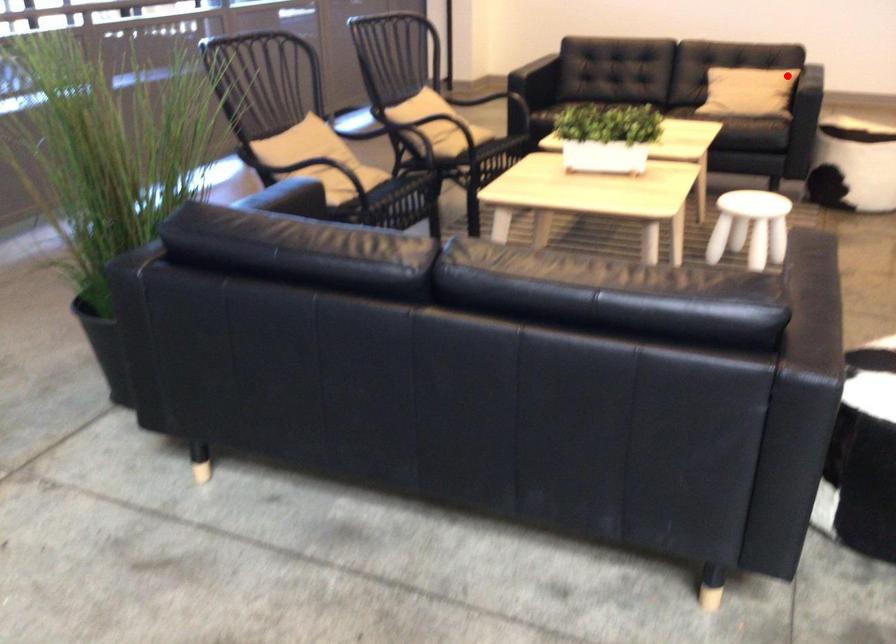
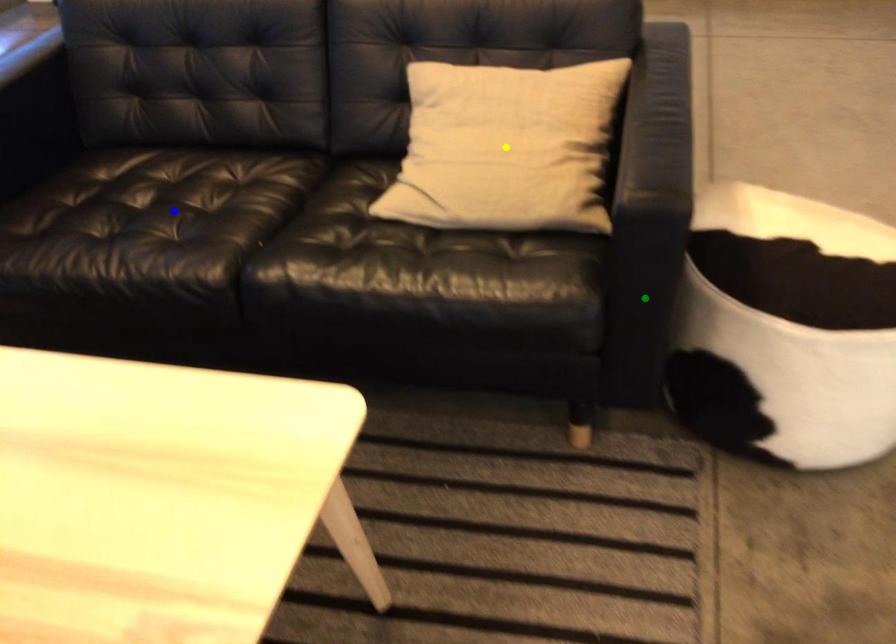
Question: I am providing you with two images of the same scene from different viewpoints. A red point is marked on the first image. You are given multiple points on the second image. In image 2, which mark is for the same physical point as the one in image 1?

Choices:
 (A) green point
 (B) blue point
 (C) yellow point

Answer: (C)